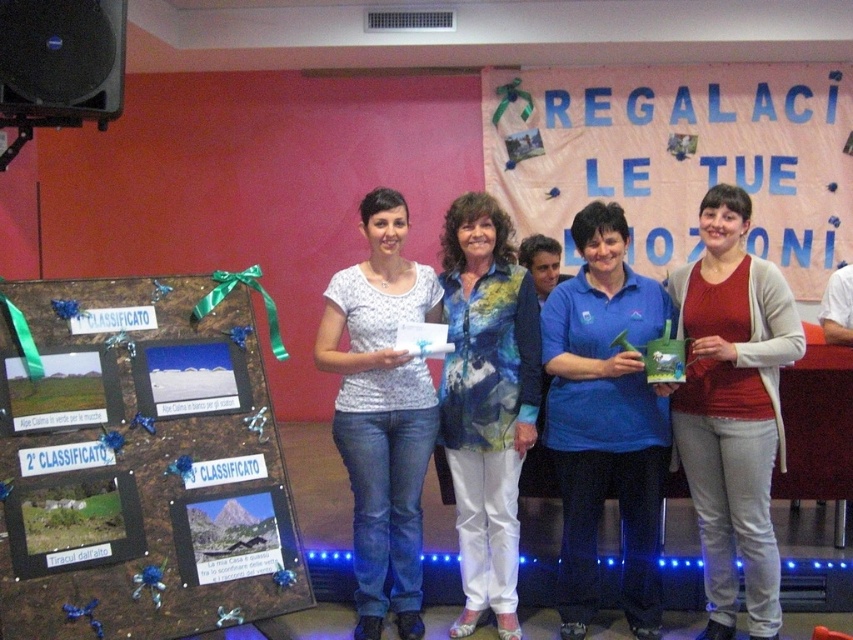
Is blue fabric shirt at center thinner than matte red sweater at right?

Incorrect, blue fabric shirt at center's width is not less than matte red sweater at right's.

Can you confirm if blue fabric shirt at center is shorter than matte red sweater at right?

Indeed, blue fabric shirt at center has a lesser height compared to matte red sweater at right.

The width and height of the screenshot is (853, 640). Find the location of `blue fabric shirt at center`. blue fabric shirt at center is located at coordinates (605, 420).

Which is more to the right, brown wooden board at left or matte red sweater at right?

matte red sweater at right

Does point (129, 428) lie behind point (766, 424)?

No, (129, 428) is closer to viewer.

Which is in front, point (53, 285) or point (714, 524)?

Point (53, 285) is in front.

Identify the location of brown wooden board at left. The height and width of the screenshot is (640, 853). (137, 464).

Does brown wooden board at left have a lesser height compared to white printed shirt at center?

Indeed, brown wooden board at left has a lesser height compared to white printed shirt at center.

Measure the distance between brown wooden board at left and camera.

brown wooden board at left is 7.40 feet away from camera.

The height and width of the screenshot is (640, 853). In order to click on brown wooden board at left in this screenshot , I will do `click(137, 464)`.